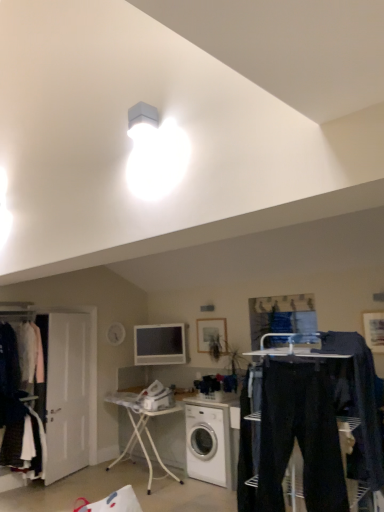
Question: Is dark blue jeans at center positioned far away from white metal ironing board at center?

Choices:
 (A) no
 (B) yes

Answer: (B)

Question: Does dark blue jeans at center have a larger size compared to white metal ironing board at center?

Choices:
 (A) yes
 (B) no

Answer: (B)

Question: Would you say dark blue jeans at center contains white metal ironing board at center?

Choices:
 (A) yes
 (B) no

Answer: (B)

Question: From the image's perspective, is dark blue jeans at center above white metal ironing board at center?

Choices:
 (A) yes
 (B) no

Answer: (A)

Question: From a real-world perspective, is dark blue jeans at center located beneath white metal ironing board at center?

Choices:
 (A) no
 (B) yes

Answer: (A)

Question: Is dark blue jeans at center aimed at white metal ironing board at center?

Choices:
 (A) no
 (B) yes

Answer: (A)

Question: Can you confirm if matte black clothes at left, the first closet in the front-to-back sequence, is shorter than white glossy washing machine at center?

Choices:
 (A) yes
 (B) no

Answer: (B)

Question: Is the surface of matte black clothes at left, positioned as the second closet in back-to-front order, in direct contact with white glossy washing machine at center?

Choices:
 (A) yes
 (B) no

Answer: (B)

Question: Is white glossy washing machine at center surrounded by matte black clothes at left, the first closet in the front-to-back sequence?

Choices:
 (A) yes
 (B) no

Answer: (B)

Question: Is white glossy washing machine at center at the back of matte black clothes at left, positioned as the second closet in back-to-front order?

Choices:
 (A) no
 (B) yes

Answer: (A)

Question: Does matte black clothes at left, the first closet in the front-to-back sequence, have a greater width compared to white glossy washing machine at center?

Choices:
 (A) yes
 (B) no

Answer: (B)

Question: Is matte black clothes at left, positioned as the second closet in back-to-front order, facing towards white glossy washing machine at center?

Choices:
 (A) no
 (B) yes

Answer: (A)

Question: Can you confirm if white glossy washing machine at center is smaller than dark blue jeans at center?

Choices:
 (A) yes
 (B) no

Answer: (B)